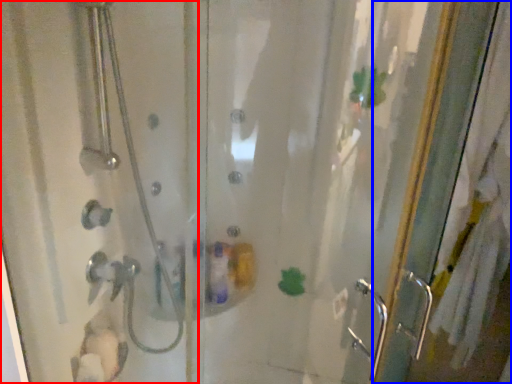
Question: Which of the following is the closest to the observer, shower door (highlighted by a red box) or screen door (highlighted by a blue box)?

Choices:
 (A) shower door
 (B) screen door

Answer: (A)